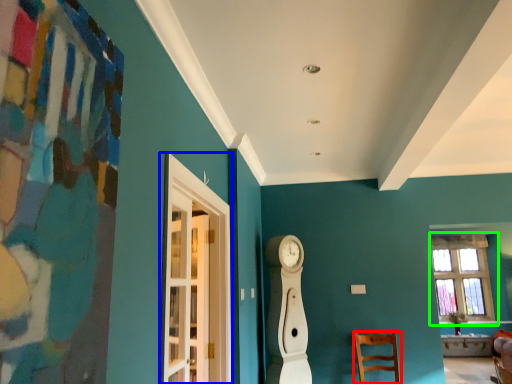
Question: Which object is the closest to the chair (highlighted by a red box)? Choose among these: glass door (highlighted by a blue box) or window (highlighted by a green box).

Choices:
 (A) glass door
 (B) window

Answer: (B)